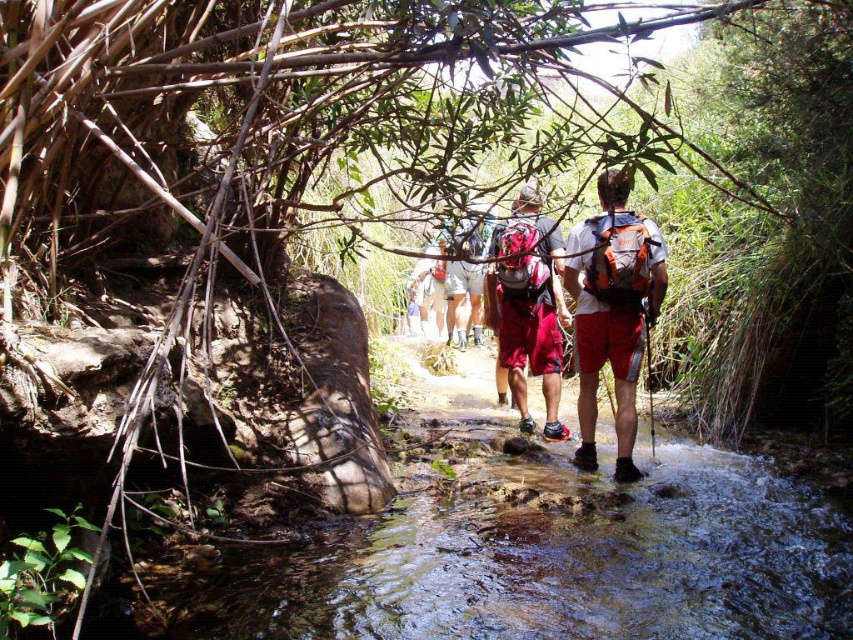
Is point (602, 307) positioned behind point (567, 429)?

No.

Who is positioned more to the left, matte orange backpack at center or matte red shorts at center?

Positioned to the left is matte red shorts at center.

Is point (621, 198) positioned behind point (550, 275)?

No, (621, 198) is in front of (550, 275).

This screenshot has width=853, height=640. I want to click on matte orange backpack at center, so click(x=612, y=310).